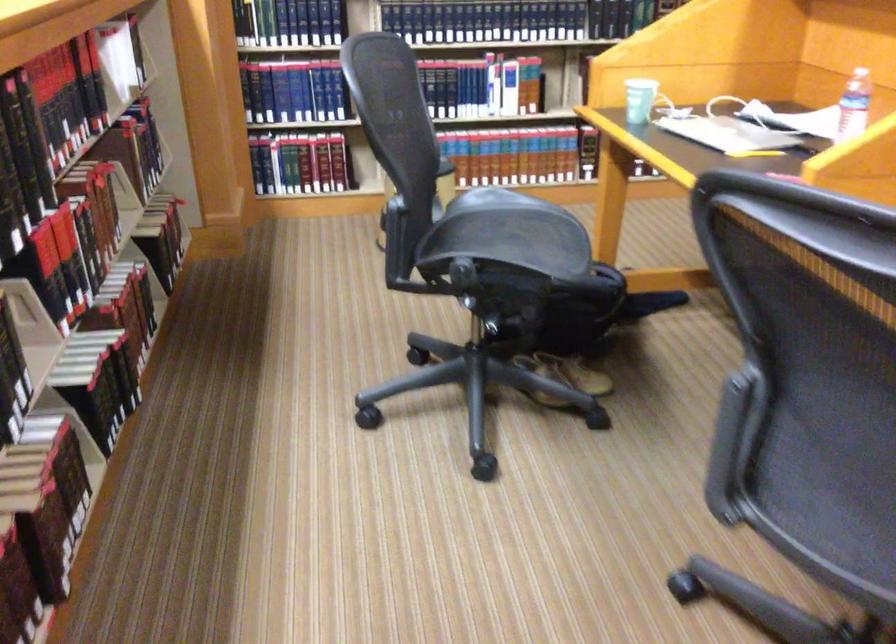
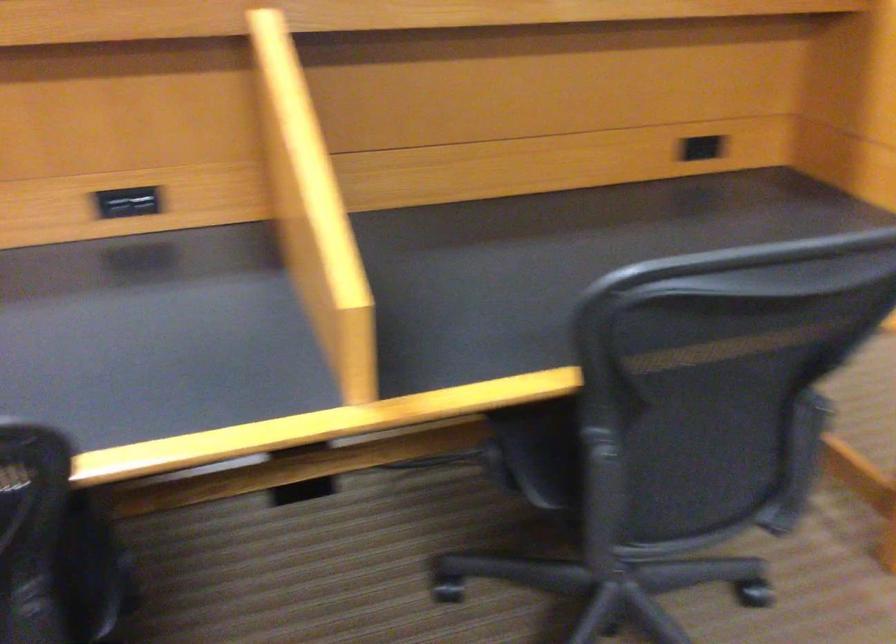
Question: I am providing you with two images of the same scene from different viewpoints. Please identify which objects are invisible in image2.

Choices:
 (A) black power outlet
 (B) large pipe wrench
 (C) chair sitting surface
 (D) chair armrest

Answer: (C)